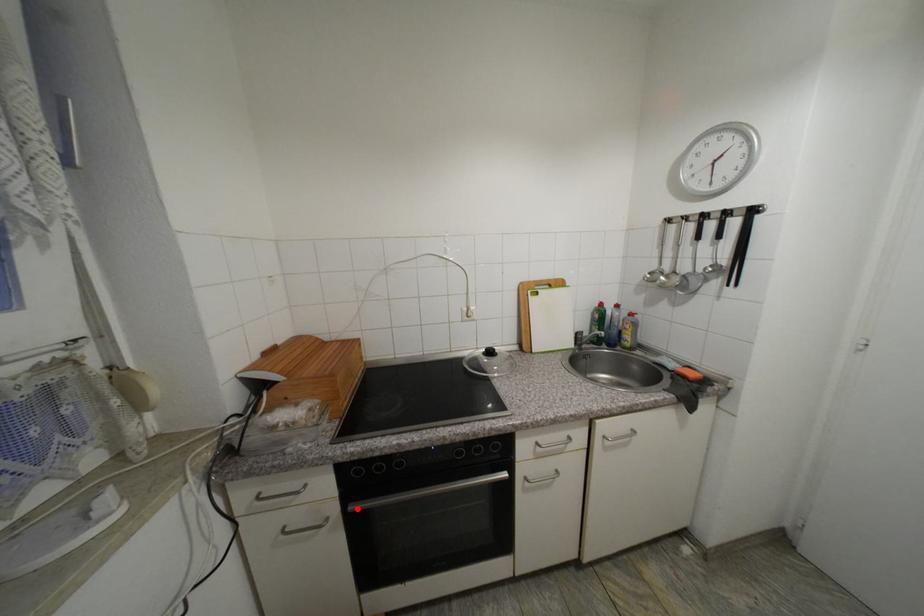
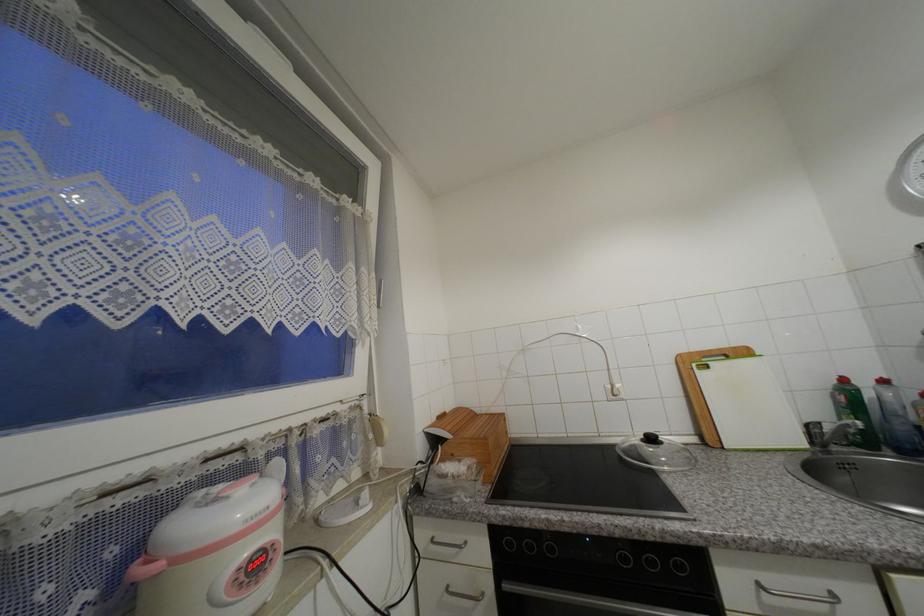
Find the pixel in the second image that matches the highlighted location in the first image.

(512, 588)